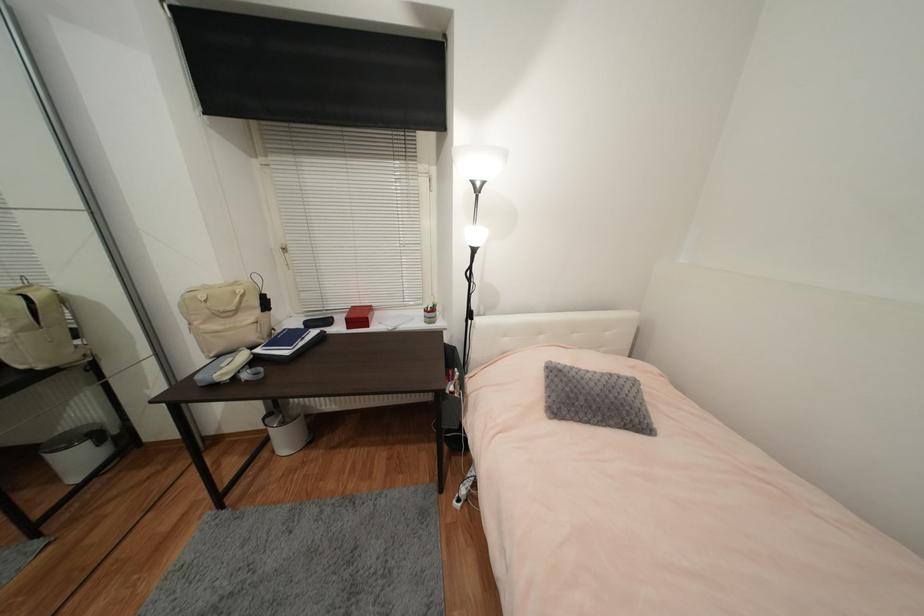
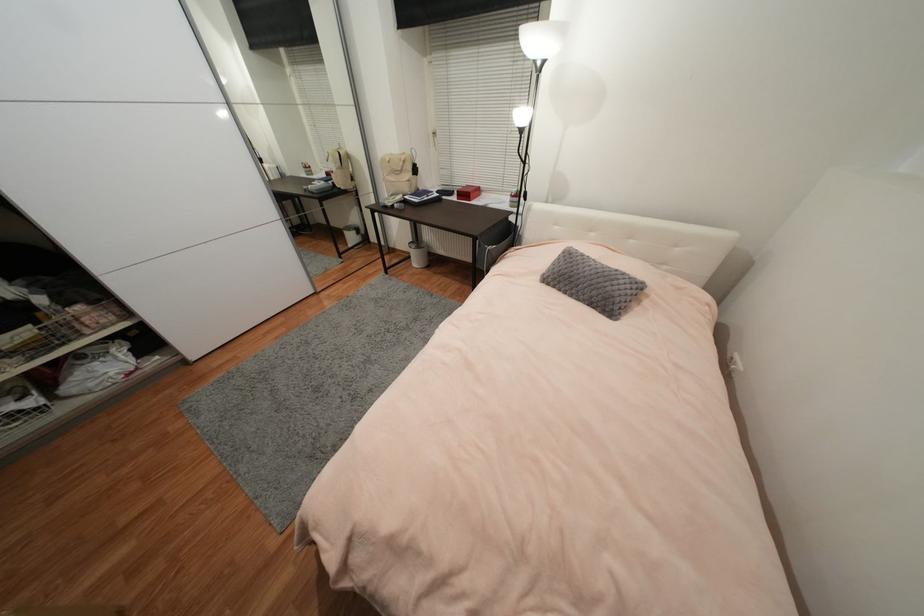
Locate, in the second image, the point that corresponds to (x=344, y=329) in the first image.

(458, 199)